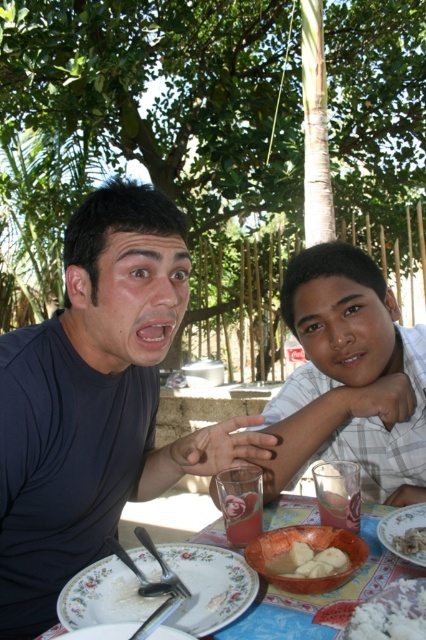
Question: Which object is the farthest from the white ceramic plate at lower center?

Choices:
 (A) white fluffy rice at lower right
 (B) smooth clay bowl at center

Answer: (A)

Question: Among these objects, which one is nearest to the camera?

Choices:
 (A) smooth clay bowl at center
 (B) white fluffy rice at lower right
 (C) white creamy rice at lower right

Answer: (B)

Question: Can you confirm if dark blue shirt at left is positioned above white ceramic plate at lower right?

Choices:
 (A) yes
 (B) no

Answer: (A)

Question: Which object is positioned closest to the smooth clay bowl at center?

Choices:
 (A) white fluffy rice at lower right
 (B) dark blue shirt at left

Answer: (A)

Question: Is white ceramic plate at lower center thinner than white creamy rice at lower right?

Choices:
 (A) yes
 (B) no

Answer: (B)

Question: In this image, where is dark blue shirt at left located relative to floral porcelain plate at lower center?

Choices:
 (A) below
 (B) above

Answer: (B)